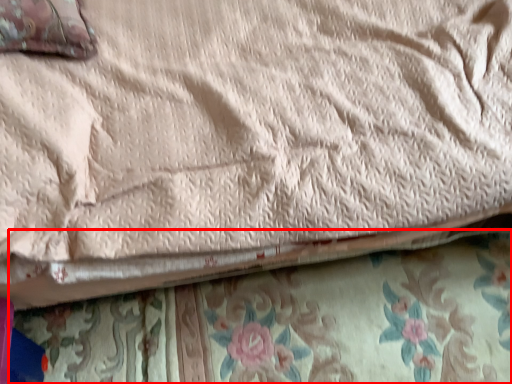
Question: From the image's perspective, where is blanket (annotated by the red box) located relative to pillow?

Choices:
 (A) above
 (B) below

Answer: (B)